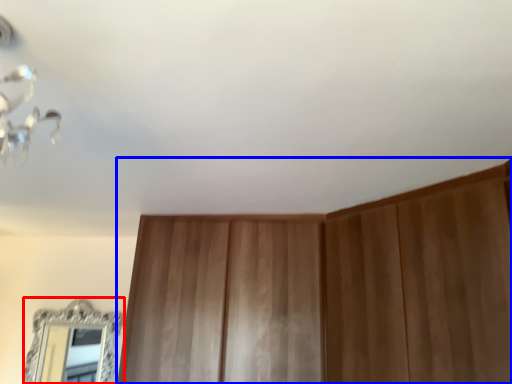
Question: Which point is further to the camera, mirror (highlighted by a red box) or dresser (highlighted by a blue box)?

Choices:
 (A) mirror
 (B) dresser

Answer: (A)